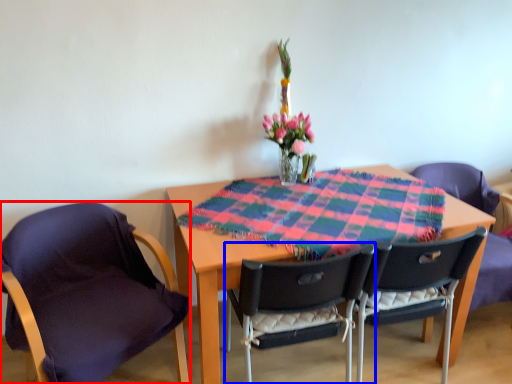
Question: Among these objects, which one is farthest to the camera, chair (highlighted by a red box) or chair (highlighted by a blue box)?

Choices:
 (A) chair
 (B) chair

Answer: (B)